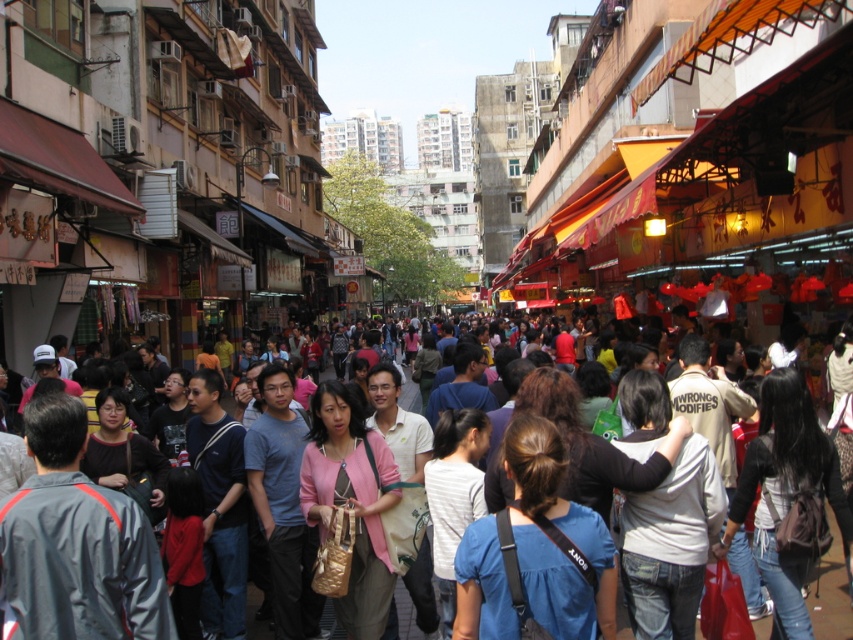
Question: Does white matte shirt at center have a greater width compared to white striped shirt at center?

Choices:
 (A) no
 (B) yes

Answer: (B)

Question: Which point is closer to the camera?

Choices:
 (A) (656, 630)
 (B) (563, 448)
 (C) (109, 388)

Answer: (A)

Question: Considering the real-world distances, which object is farthest from the blue fabric shirt at center?

Choices:
 (A) pink fabric jacket at center
 (B) pink fabric purse at center
 (C) black leather backpack at center-right
 (D) white matte shirt at center

Answer: (B)

Question: Does white matte shirt at center appear over pink fabric jacket at center?

Choices:
 (A) yes
 (B) no

Answer: (A)

Question: Does pink fabric jacket at center have a greater width compared to matte black jacket at center?

Choices:
 (A) yes
 (B) no

Answer: (A)

Question: Which of the following is the farthest from the observer?

Choices:
 (A) gray fabric jacket at center
 (B) black leather backpack at center-right
 (C) blue fabric shirt at center

Answer: (C)